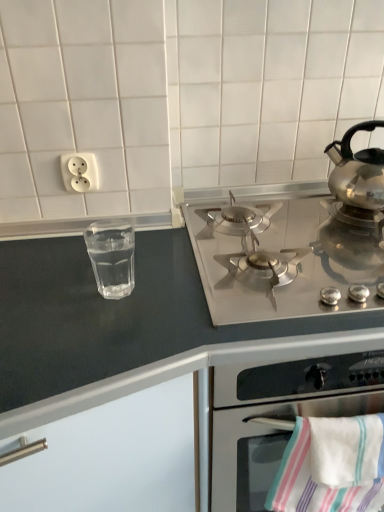
Find the location of `polished stainless steel kettle at right`. polished stainless steel kettle at right is located at coordinates (357, 170).

Describe the element at coordinates (357, 170) in the screenshot. I see `polished stainless steel kettle at right` at that location.

The image size is (384, 512). Identify the location of transparent glass at left. (112, 258).

What do you see at coordinates (79, 172) in the screenshot?
I see `white plastic outlet at upper left` at bounding box center [79, 172].

Locate an element on the screen. This screenshot has height=512, width=384. polished stainless steel kettle at right is located at coordinates (357, 170).

Is transparent glass at left shorter than white plastic outlet at upper left?

No, transparent glass at left is not shorter than white plastic outlet at upper left.

Consider the image. Measure the distance between transparent glass at left and white plastic outlet at upper left.

A distance of 7.21 inches exists between transparent glass at left and white plastic outlet at upper left.

From a real-world perspective, is transparent glass at left on top of white plastic outlet at upper left?

Actually, transparent glass at left is physically below white plastic outlet at upper left in the real world.

Between transparent glass at left and white plastic outlet at upper left, which one has larger size?

transparent glass at left is bigger.

Between satin silver gas stove at upper right and white plastic outlet at upper left, which one has smaller size?

With smaller size is white plastic outlet at upper left.

Is satin silver gas stove at upper right directly adjacent to white plastic outlet at upper left?

No, satin silver gas stove at upper right is not next to white plastic outlet at upper left.

From the image's perspective, relative to white plastic outlet at upper left, is satin silver gas stove at upper right above or below?

satin silver gas stove at upper right is below white plastic outlet at upper left.

Is satin silver gas stove at upper right inside the boundaries of white plastic outlet at upper left, or outside?

The correct answer is: outside.

The image size is (384, 512). Identify the location of countertop located on the left of polished stainless steel kettle at right. (129, 328).

Between stainless steel gas stove at upper center and polished stainless steel kettle at right, which one is positioned behind?

polished stainless steel kettle at right is more distant.

Is there a large distance between stainless steel gas stove at upper center and polished stainless steel kettle at right?

stainless steel gas stove at upper center is actually quite close to polished stainless steel kettle at right.

Based on the photo, does stainless steel gas stove at upper center appear on the right side of polished stainless steel kettle at right?

No.

Which object is thinner, white striped towel at lower right or white plastic outlet at upper left?

white plastic outlet at upper left.

From the image's perspective, is white striped towel at lower right above or below white plastic outlet at upper left?

Based on their image positions, white striped towel at lower right is located beneath white plastic outlet at upper left.

Looking at this image, from a real-world perspective, is white striped towel at lower right over white plastic outlet at upper left?

No, from a real-world perspective, white striped towel at lower right is not over white plastic outlet at upper left

Is white striped towel at lower right bigger than white plastic outlet at upper left?

Correct, white striped towel at lower right is larger in size than white plastic outlet at upper left.

Is satin silver gas stove at upper right facing away from transparent glass at left?

No, transparent glass at left is not at the back of satin silver gas stove at upper right.

Locate an element on the screen. gas stove that appears below the transparent glass at left (from a real-world perspective) is located at coordinates (282, 259).

Which of these two, satin silver gas stove at upper right or transparent glass at left, is wider?

satin silver gas stove at upper right.

Considering the relative sizes of satin silver gas stove at upper right and transparent glass at left in the image provided, is satin silver gas stove at upper right smaller than transparent glass at left?

No.

Is the depth of white striped towel at lower right less than that of transparent glass at left?

Yes, white striped towel at lower right is in front of transparent glass at left.

From a real-world perspective, is white striped towel at lower right positioned under transparent glass at left based on gravity?

Indeed, from a real-world perspective, white striped towel at lower right is positioned beneath transparent glass at left.

Is white striped towel at lower right directly adjacent to transparent glass at left?

white striped towel at lower right is not next to transparent glass at left, and they're not touching.

Considering the sizes of white striped towel at lower right and transparent glass at left in the image, is white striped towel at lower right taller or shorter than transparent glass at left?

white striped towel at lower right is taller than transparent glass at left.

In terms of size, does satin silver gas stove at upper right appear bigger or smaller than polished stainless steel kettle at right?

In the image, satin silver gas stove at upper right appears to be larger than polished stainless steel kettle at right.

Considering the relative sizes of satin silver gas stove at upper right and polished stainless steel kettle at right in the image provided, is satin silver gas stove at upper right shorter than polished stainless steel kettle at right?

Yes, satin silver gas stove at upper right is shorter than polished stainless steel kettle at right.

Between point (195, 237) and point (340, 187), which one is positioned behind?

The point (195, 237) is farther from the camera.

From the image's perspective, is satin silver gas stove at upper right located above or below polished stainless steel kettle at right?

satin silver gas stove at upper right is situated lower than polished stainless steel kettle at right in the image.

The image size is (384, 512). What are the coordinates of `glass jar below the white plastic outlet at upper left (from the image's perspective)` in the screenshot? It's located at (112, 258).

At what (x,y) coordinates should I click in order to perform the action: click on electric outlet on the left of the satin silver gas stove at upper right. Please return your answer as a coordinate pair (x, y). Looking at the image, I should click on (79, 172).

Looking at this image, which object lies further to the anchor point polished stainless steel kettle at right, transparent glass at left or stainless steel gas stove at upper center?

transparent glass at left is positioned further to the anchor polished stainless steel kettle at right.

Considering their positions, is stainless steel gas stove at upper center positioned further to satin silver gas stove at upper right than polished stainless steel kettle at right?

polished stainless steel kettle at right is positioned further to the anchor satin silver gas stove at upper right.

From the image, which object appears to be nearer to white plastic outlet at upper left, polished stainless steel kettle at right or satin silver gas stove at upper right?

satin silver gas stove at upper right is closer to white plastic outlet at upper left.

Considering their positions, is stainless steel gas stove at upper center positioned closer to white striped towel at lower right than polished stainless steel kettle at right?

stainless steel gas stove at upper center is positioned closer to the anchor white striped towel at lower right.

Which object lies nearer to the anchor point stainless steel gas stove at upper center, white plastic outlet at upper left or polished stainless steel kettle at right?

The object closer to stainless steel gas stove at upper center is white plastic outlet at upper left.

Estimate the real-world distances between objects in this image. Which object is further from polished stainless steel kettle at right, stainless steel gas stove at upper center or transparent glass at left?

transparent glass at left.

Considering their positions, is stainless steel gas stove at upper center positioned closer to white striped towel at lower right than transparent glass at left?

The object closer to white striped towel at lower right is stainless steel gas stove at upper center.

Estimate the real-world distances between objects in this image. Which object is further from white plastic outlet at upper left, transparent glass at left or stainless steel gas stove at upper center?

stainless steel gas stove at upper center is further to white plastic outlet at upper left.

Find the location of a particular element. countertop between polished stainless steel kettle at right and white striped towel at lower right from top to bottom is located at coordinates (129, 328).

I want to click on glass jar between white plastic outlet at upper left and satin silver gas stove at upper right from left to right, so click(x=112, y=258).

Find the location of a particular element. The image size is (384, 512). gas stove situated between transparent glass at left and stainless steel gas stove at upper center from left to right is located at coordinates (282, 259).

This screenshot has height=512, width=384. I want to click on beach towel between transparent glass at left and satin silver gas stove at upper right in the horizontal direction, so click(x=331, y=466).